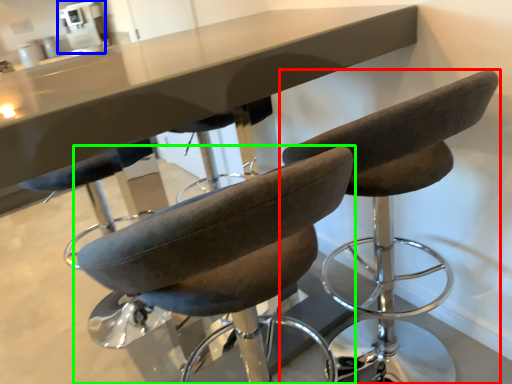
Question: Estimate the real-world distances between objects in this image. Which object is farther from chair (highlighted by a red box), coffee machine (highlighted by a blue box) or chair (highlighted by a green box)?

Choices:
 (A) coffee machine
 (B) chair

Answer: (A)